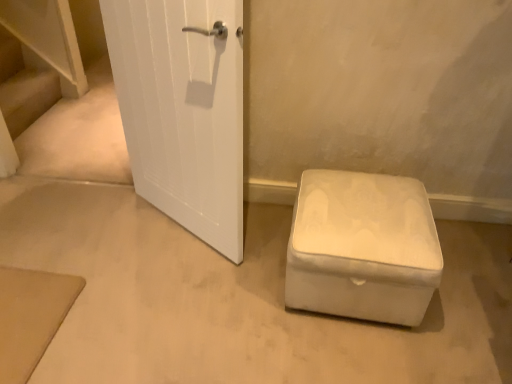
Image resolution: width=512 pixels, height=384 pixels. Identify the location of wooden stairs at left. [23, 87].

This screenshot has width=512, height=384. Describe the element at coordinates (23, 87) in the screenshot. I see `wooden stairs at left` at that location.

Where is `white fabric ottoman at lower right`? This screenshot has height=384, width=512. white fabric ottoman at lower right is located at coordinates (362, 247).

Describe the element at coordinates (362, 247) in the screenshot. I see `white fabric ottoman at lower right` at that location.

Find the location of a particular element. The image size is (512, 384). wooden stairs at left is located at coordinates (23, 87).

Visually, is white fabric ottoman at lower right positioned to the left or to the right of wooden stairs at left?

Clearly, white fabric ottoman at lower right is on the right of wooden stairs at left in the image.

Based on the photo, considering their positions, is white fabric ottoman at lower right located in front of or behind wooden stairs at left?

Visually, white fabric ottoman at lower right is located in front of wooden stairs at left.

Is point (340, 290) more distant than point (13, 115)?

That is False.

From the image's perspective, does white fabric ottoman at lower right appear lower than wooden stairs at left?

A: Yes, from the image's perspective, white fabric ottoman at lower right is beneath wooden stairs at left.

From a real-world perspective, between white fabric ottoman at lower right and wooden stairs at left, who is vertically lower?

wooden stairs at left.

Looking at this image, between white fabric ottoman at lower right and wooden stairs at left, which one has larger width?

white fabric ottoman at lower right.

Does white fabric ottoman at lower right have a greater height compared to wooden stairs at left?

Correct, white fabric ottoman at lower right is much taller as wooden stairs at left.

Considering the relative sizes of white fabric ottoman at lower right and wooden stairs at left in the image provided, is white fabric ottoman at lower right bigger than wooden stairs at left?

Correct, white fabric ottoman at lower right is larger in size than wooden stairs at left.

Based on the photo, is wooden stairs at left a part of white fabric ottoman at lower right?

No, white fabric ottoman at lower right does not contain wooden stairs at left.

Is white fabric ottoman at lower right not close to wooden stairs at left?

Yes.

Is white fabric ottoman at lower right oriented towards wooden stairs at left?

No, white fabric ottoman at lower right does not turn towards wooden stairs at left.

What's the angular difference between white fabric ottoman at lower right and wooden stairs at left's facing directions?

90.7 degrees.

Measure the distance from white fabric ottoman at lower right to wooden stairs at left.

white fabric ottoman at lower right and wooden stairs at left are 7.29 feet apart from each other.

You are a GUI agent. You are given a task and a screenshot of the screen. Output one action in this format:
    pyautogui.click(x=<x>, y=<y>)
    Task: Click on the stairwell below the white fabric ottoman at lower right (from a real-world perspective)
    The image size is (512, 384).
    Given the screenshot: What is the action you would take?
    pyautogui.click(x=23, y=87)

Consider the image. Which is more to the right, wooden stairs at left or white fabric ottoman at lower right?

Positioned to the right is white fabric ottoman at lower right.

Consider the image. Which is behind, wooden stairs at left or white fabric ottoman at lower right?

wooden stairs at left.

Does point (10, 113) lie behind point (318, 191)?

Yes, point (10, 113) is farther from viewer.

From the image's perspective, which is above, wooden stairs at left or white fabric ottoman at lower right?

wooden stairs at left, from the image's perspective.

From a real-world perspective, between wooden stairs at left and white fabric ottoman at lower right, who is vertically higher?

white fabric ottoman at lower right.

Considering the sizes of objects wooden stairs at left and white fabric ottoman at lower right in the image provided, who is wider, wooden stairs at left or white fabric ottoman at lower right?

white fabric ottoman at lower right.

Which of these two, wooden stairs at left or white fabric ottoman at lower right, stands shorter?

wooden stairs at left.

Considering the sizes of wooden stairs at left and white fabric ottoman at lower right in the image, is wooden stairs at left bigger or smaller than white fabric ottoman at lower right?

wooden stairs at left is smaller than white fabric ottoman at lower right.

Is wooden stairs at left completely or partially outside of white fabric ottoman at lower right?

Yes.

Does wooden stairs at left touch white fabric ottoman at lower right?

wooden stairs at left is not next to white fabric ottoman at lower right, and they're not touching.

Could you tell me if wooden stairs at left is facing white fabric ottoman at lower right?

Yes, wooden stairs at left faces towards white fabric ottoman at lower right.

How different are the orientations of wooden stairs at left and white fabric ottoman at lower right in degrees?

wooden stairs at left and white fabric ottoman at lower right are facing 90.7 degrees away from each other.

The height and width of the screenshot is (384, 512). Identify the location of stairwell above the white fabric ottoman at lower right (from the image's perspective). (23, 87).

I want to click on stairwell that is behind the white fabric ottoman at lower right, so pyautogui.click(x=23, y=87).

Identify the location of stairwell above the white fabric ottoman at lower right (from the image's perspective). (23, 87).